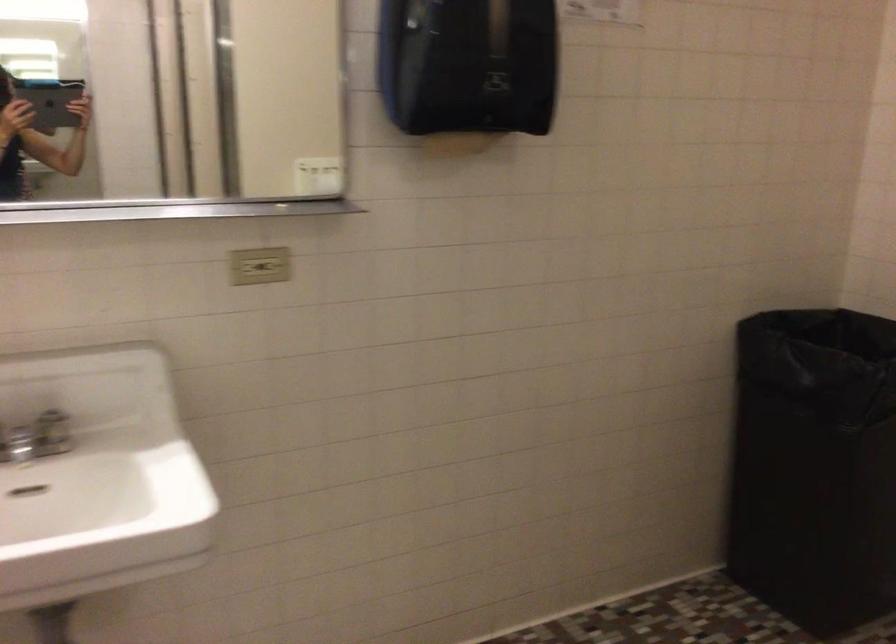
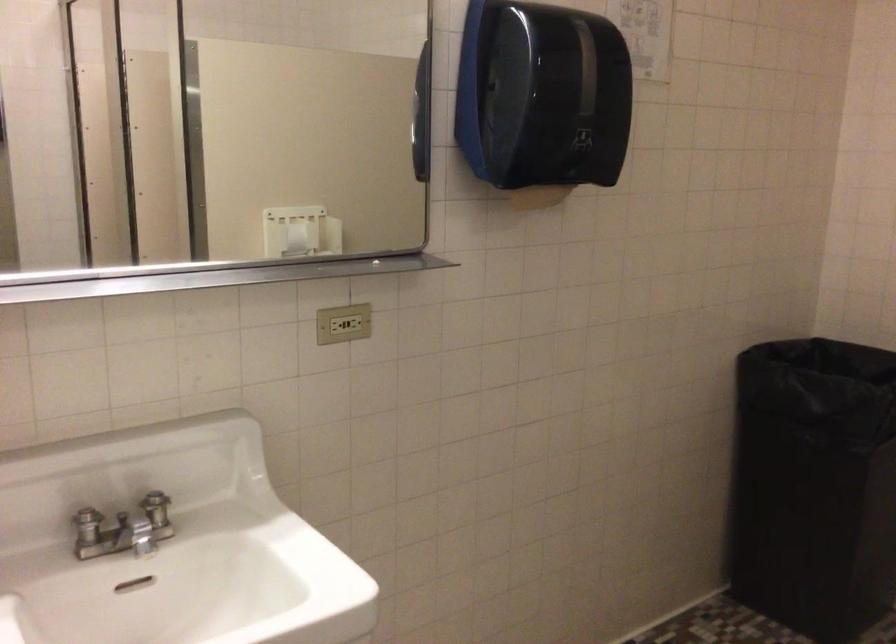
Question: The images are taken continuously from a first-person perspective. In which direction are you moving?

Choices:
 (A) Left
 (B) Right
 (C) Forward
 (D) Backward

Answer: (A)